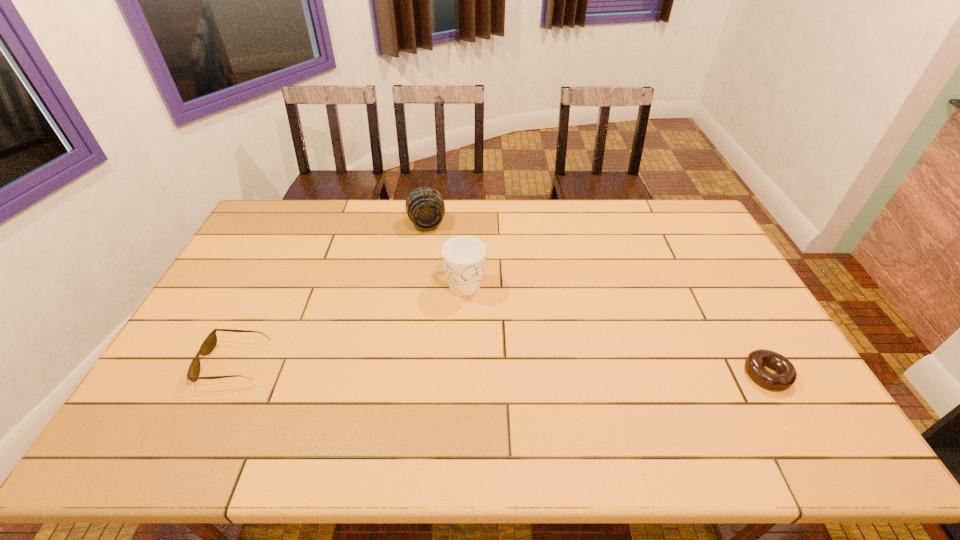
In order to click on vacant space located 0.140m on the side of the third object from left to right with the handle in this screenshot , I will do `click(494, 331)`.

This screenshot has width=960, height=540. I want to click on vacant space positioned on the side of the third object from left to right with the handle, so click(x=528, y=382).

The height and width of the screenshot is (540, 960). Identify the location of free space located 0.050m at the front element of the farthest object. (431, 243).

Image resolution: width=960 pixels, height=540 pixels. Identify the location of vacant space located at the front element of the farthest object. (436, 263).

This screenshot has width=960, height=540. I want to click on vacant area situated at the front element of the farthest object, so click(438, 273).

Identify the location of object that is at the far edge. The width and height of the screenshot is (960, 540). (425, 207).

Find the location of a particular element. The width and height of the screenshot is (960, 540). sunglasses at the near edge is located at coordinates (208, 345).

Identify the location of doughnut that is at the near edge. This screenshot has height=540, width=960. (786, 375).

Locate an element on the screen. The image size is (960, 540). object that is positioned at the left edge is located at coordinates (208, 345).

What are the coordinates of `object at the right edge` in the screenshot? It's located at (786, 375).